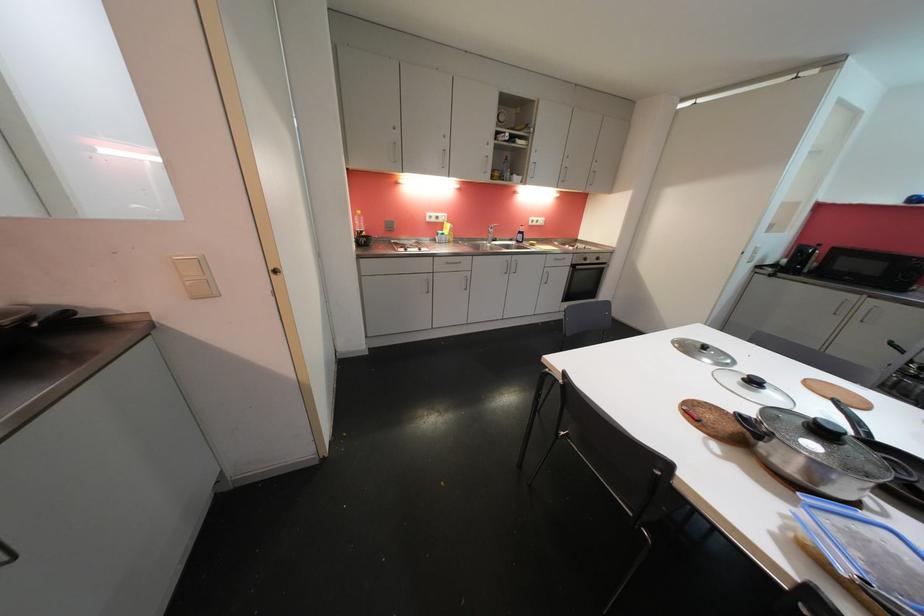
Locate an element on the screen. The image size is (924, 616). black pan handle is located at coordinates (853, 419).